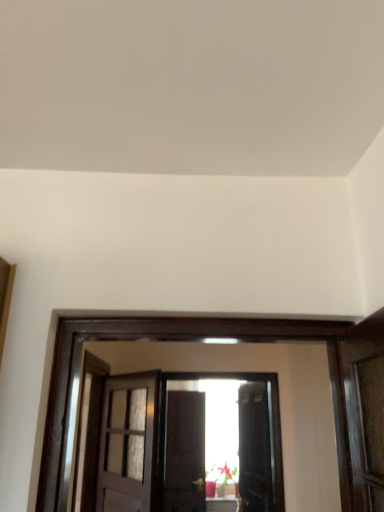
Question: Is matte white door at center, which is counted as the first door, starting from the left, to the right of matte black door at center, the 1th door from the back, from the viewer's perspective?

Choices:
 (A) yes
 (B) no

Answer: (B)

Question: Are matte white door at center, the second door positioned from the right, and matte black door at center, the first door from the right, beside each other?

Choices:
 (A) yes
 (B) no

Answer: (B)

Question: Does matte white door at center, the second door positioned from the right, contain matte black door at center, the 1th door from the back?

Choices:
 (A) yes
 (B) no

Answer: (B)

Question: Considering the relative sizes of matte white door at center, marked as the 2th door in a back-to-front arrangement, and matte black door at center, the 1th door from the back, in the image provided, is matte white door at center, marked as the 2th door in a back-to-front arrangement, taller than matte black door at center, the 1th door from the back,?

Choices:
 (A) yes
 (B) no

Answer: (B)

Question: Can you confirm if matte white door at center, which is counted as the first door, starting from the left, is shorter than matte black door at center, marked as the second door in a left-to-right arrangement?

Choices:
 (A) no
 (B) yes

Answer: (B)

Question: Is matte white door at center, which is counted as the first door, starting from the left, wider than matte black door at center, which appears as the second door when viewed from the front?

Choices:
 (A) yes
 (B) no

Answer: (B)

Question: Is matte black door at center, which appears as the second door when viewed from the front, further to camera compared to matte white door at center, which is counted as the first door, starting from the left?

Choices:
 (A) yes
 (B) no

Answer: (A)

Question: Is matte white door at center, which is counted as the first door, starting from the left, at the back of matte black door at center, marked as the second door in a left-to-right arrangement?

Choices:
 (A) yes
 (B) no

Answer: (B)

Question: Does matte black door at center, the first door from the right, lie in front of matte white door at center, marked as the 2th door in a back-to-front arrangement?

Choices:
 (A) no
 (B) yes

Answer: (A)

Question: From a real-world perspective, does matte black door at center, marked as the second door in a left-to-right arrangement, stand above matte white door at center, which is counted as the first door, starting from the left?

Choices:
 (A) yes
 (B) no

Answer: (B)

Question: Is matte black door at center, marked as the second door in a left-to-right arrangement, thinner than matte white door at center, the second door positioned from the right?

Choices:
 (A) no
 (B) yes

Answer: (A)

Question: Considering the relative sizes of matte black door at center, the first door from the right, and matte white door at center, marked as the 2th door in a back-to-front arrangement, in the image provided, is matte black door at center, the first door from the right, bigger than matte white door at center, marked as the 2th door in a back-to-front arrangement,?

Choices:
 (A) no
 (B) yes

Answer: (B)

Question: Relative to matte black door at center, the first door from the right, is matte white door at center, which is counted as the first door, starting from the left, in front or behind?

Choices:
 (A) front
 (B) behind

Answer: (A)